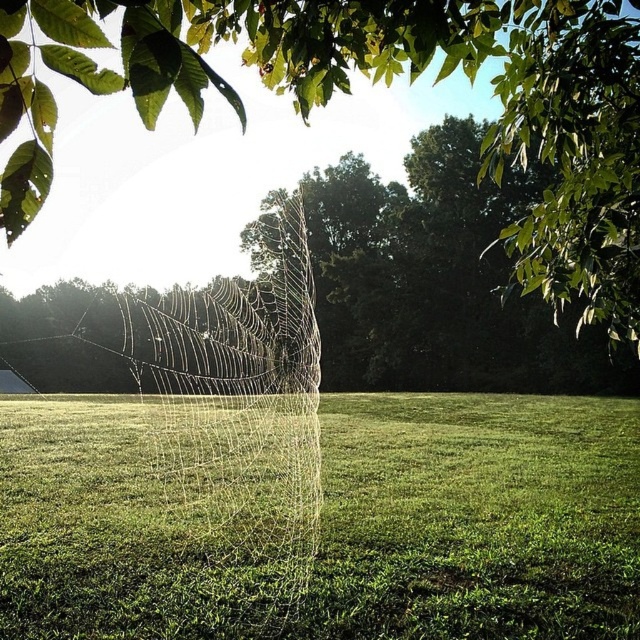
Question: Which of the following is the farthest from the observer?

Choices:
 (A) (387, 499)
 (B) (189, 312)

Answer: (B)

Question: Which point appears closest to the camera in this image?

Choices:
 (A) (220, 304)
 (B) (326, 529)
 (C) (273, 64)
 (D) (272, 518)

Answer: (C)

Question: Estimate the real-world distances between objects in this image. Which object is farther from the green grass at center?

Choices:
 (A) transparent silk spider web at center
 (B) transparent silk web at center
 (C) green leafy tree at center

Answer: (B)

Question: Can you confirm if green leafy tree at center is positioned to the left of transparent silk spider web at center?

Choices:
 (A) yes
 (B) no

Answer: (B)

Question: Can you confirm if green grass at center is positioned to the left of transparent silk spider web at center?

Choices:
 (A) yes
 (B) no

Answer: (B)

Question: Does green leafy tree at center appear on the left side of transparent silk spider web at center?

Choices:
 (A) yes
 (B) no

Answer: (B)